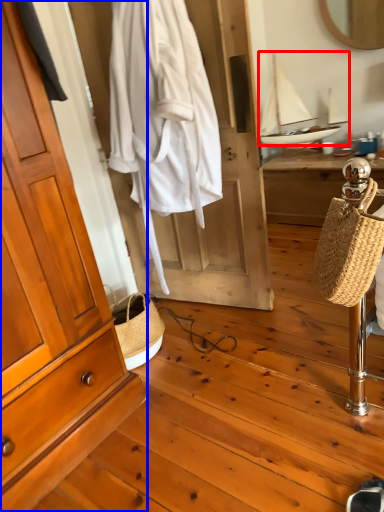
Question: Which object appears closest to the camera in this image, sailboat (highlighted by a red box) or cabinetry (highlighted by a blue box)?

Choices:
 (A) sailboat
 (B) cabinetry

Answer: (B)